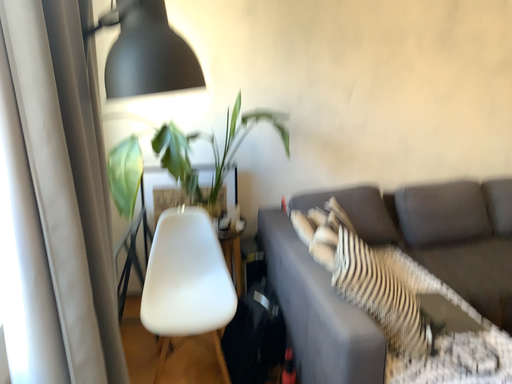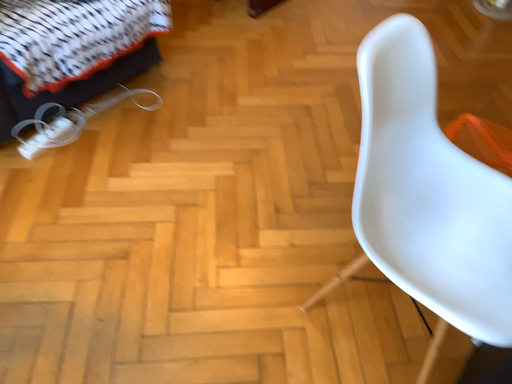
Question: How did the camera likely rotate when shooting the video?

Choices:
 (A) rotated downward
 (B) rotated upward

Answer: (A)